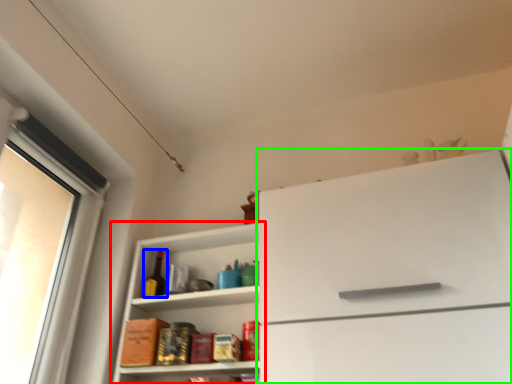
Question: Estimate the real-world distances between objects in this image. Which object is closer to shelf (highlighted by a red box), bottle (highlighted by a blue box) or cabinetry (highlighted by a green box)?

Choices:
 (A) bottle
 (B) cabinetry

Answer: (A)